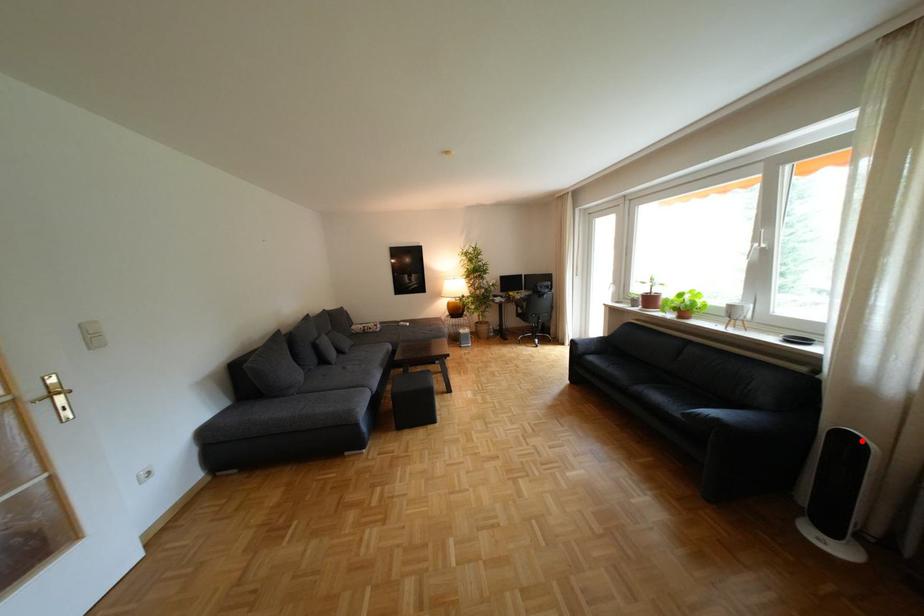
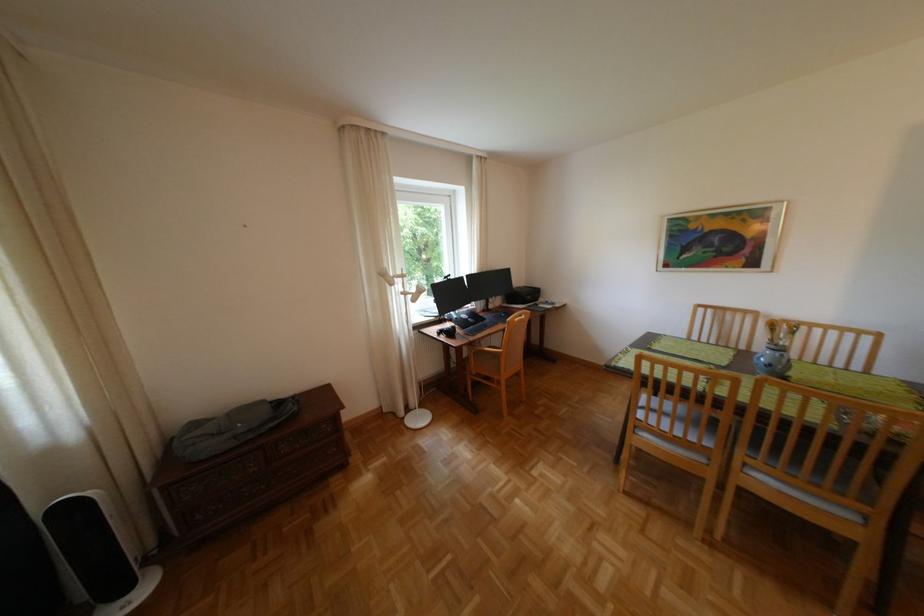
Where in the second image is the point corresponding to the highlighted location from the first image?

(83, 508)